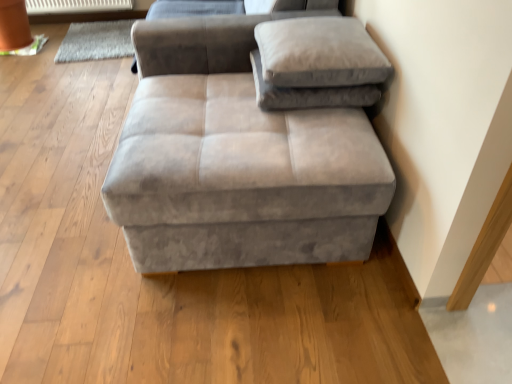
Where is `free space in front of suede gray ottoman at center`? free space in front of suede gray ottoman at center is located at coordinates (252, 325).